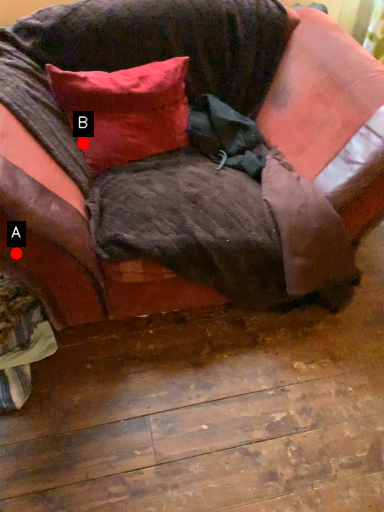
Question: Two points are circled on the image, labeled by A and B beside each circle. Among these points, which one is nearest to the camera?

Choices:
 (A) A is closer
 (B) B is closer

Answer: (A)